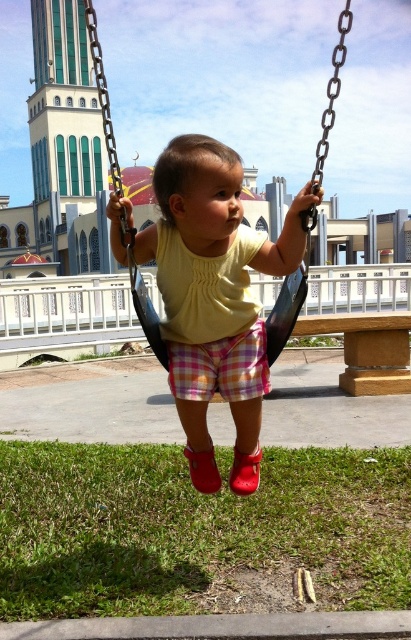
Question: Is yellow matte shirt at center smaller than black plastic swing at center?

Choices:
 (A) no
 (B) yes

Answer: (B)

Question: Observing the image, what is the correct spatial positioning of yellow matte shirt at center in reference to black plastic swing at center?

Choices:
 (A) below
 (B) above

Answer: (A)

Question: Does yellow matte shirt at center have a lesser width compared to black plastic swing at center?

Choices:
 (A) no
 (B) yes

Answer: (B)